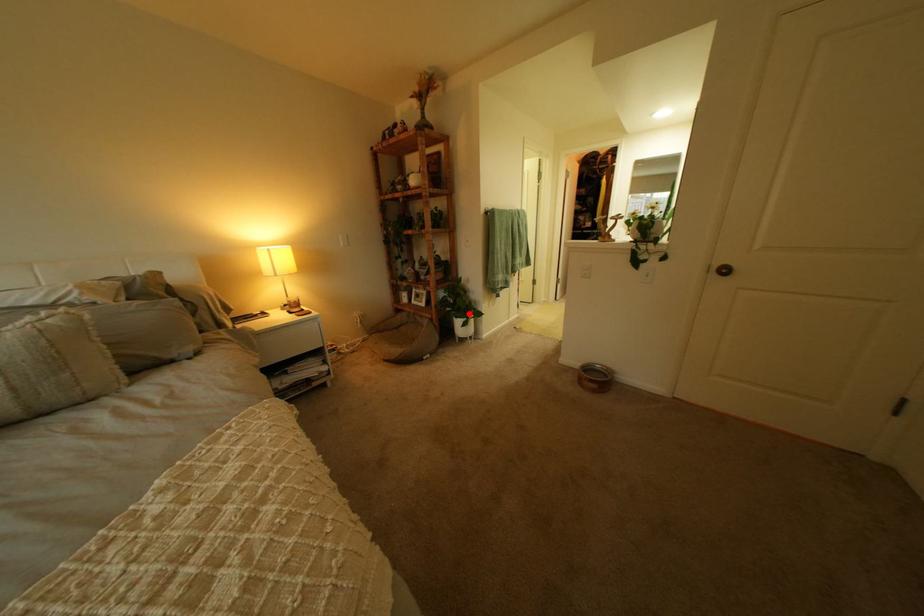
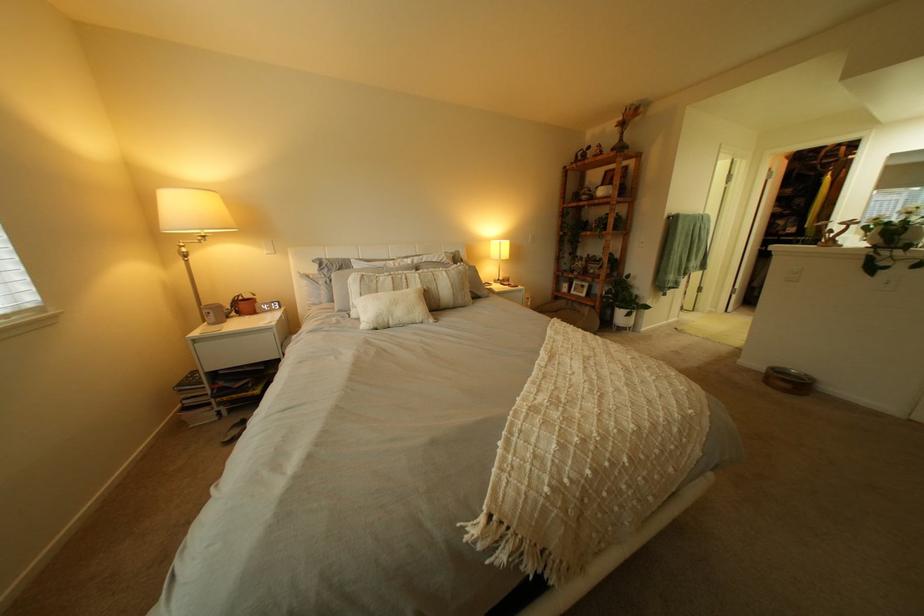
Find the pixel in the second image that matches the highlighted location in the first image.

(633, 305)